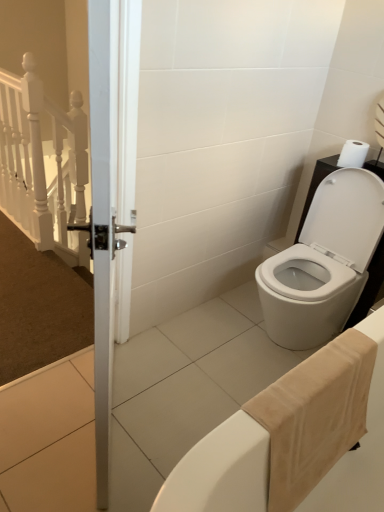
Question: Do you think white matte toilet paper at upper right is within beige cotton bath towel at lower right, or outside of it?

Choices:
 (A) outside
 (B) inside

Answer: (A)

Question: From the image's perspective, is white matte toilet paper at upper right above or below beige cotton bath towel at lower right?

Choices:
 (A) above
 (B) below

Answer: (A)

Question: Which object is positioned farthest from the white glossy toilet at lower right?

Choices:
 (A) beige cotton bath towel at lower right
 (B) white matte toilet paper at upper right

Answer: (A)

Question: Considering the real-world distances, which object is farthest from the white matte toilet paper at upper right?

Choices:
 (A) white glossy toilet at lower right
 (B) beige cotton bath towel at lower right

Answer: (B)